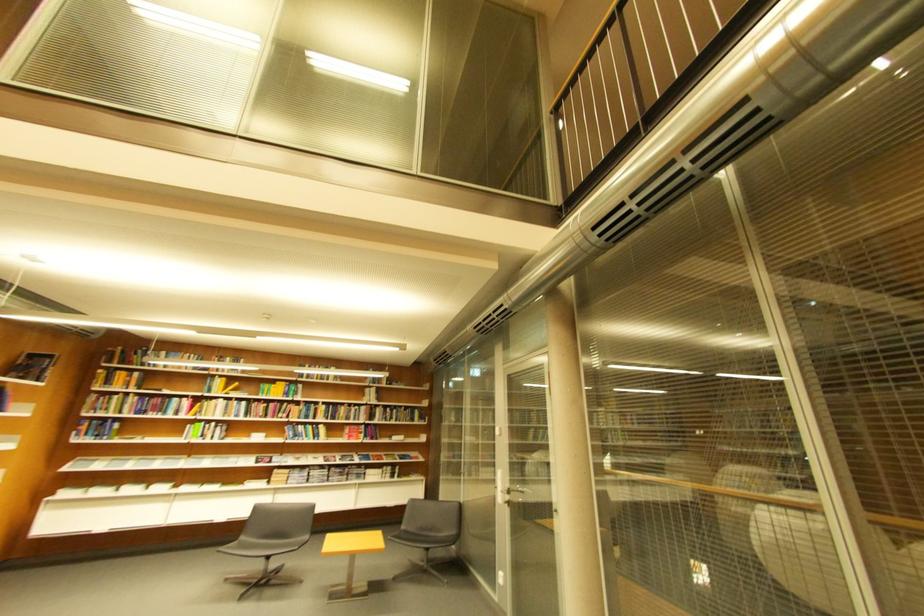
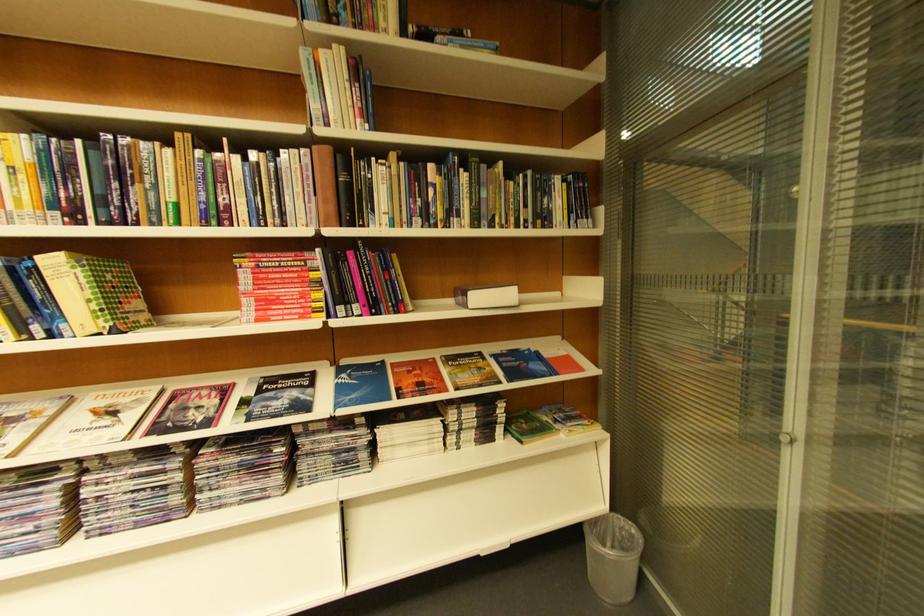
The point at (423, 421) is marked in the first image. Where is the corresponding point in the second image?

(554, 221)